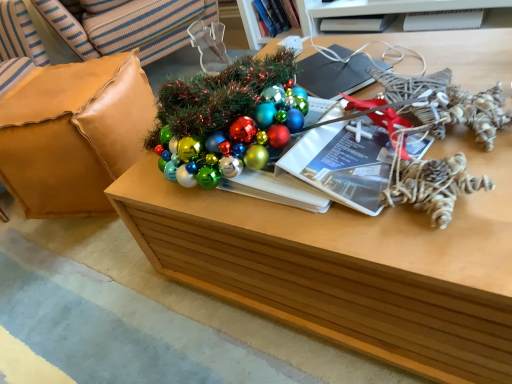
Question: Which direction should I rotate to face black matte magazine at upper center, which is the 2th magazine in front-to-back order, — up or down?

Choices:
 (A) down
 (B) up

Answer: (B)

Question: Would you say wooden table at center is part of white plastic magazine at upper right, which is counted as the third magazine, starting from the front,'s contents?

Choices:
 (A) no
 (B) yes

Answer: (A)

Question: Can you confirm if white plastic magazine at upper right, the first magazine viewed from the top, is positioned to the right of wooden table at center?

Choices:
 (A) no
 (B) yes

Answer: (B)

Question: Is white plastic magazine at upper right, which is counted as the third magazine, starting from the front, not inside wooden table at center?

Choices:
 (A) yes
 (B) no

Answer: (A)

Question: From the image's perspective, is white plastic magazine at upper right, acting as the 3th magazine starting from the left, located beneath wooden table at center?

Choices:
 (A) yes
 (B) no

Answer: (B)

Question: Is the depth of white plastic magazine at upper right, the 1th magazine from the right, less than that of wooden table at center?

Choices:
 (A) yes
 (B) no

Answer: (B)

Question: Can you see white plastic magazine at upper right, the 1th magazine from the right, touching wooden table at center?

Choices:
 (A) yes
 (B) no

Answer: (B)

Question: Can you confirm if leather cushion at left is shorter than matte paper magazine at center, which ranks as the third magazine in back-to-front order?

Choices:
 (A) no
 (B) yes

Answer: (A)

Question: Does leather cushion at left appear on the left side of matte paper magazine at center, which ranks as the third magazine in back-to-front order?

Choices:
 (A) no
 (B) yes

Answer: (B)

Question: Is leather cushion at left oriented towards matte paper magazine at center, marked as the first magazine in a bottom-to-top arrangement?

Choices:
 (A) yes
 (B) no

Answer: (A)

Question: Is leather cushion at left next to matte paper magazine at center, arranged as the 1th magazine when viewed from the left, and touching it?

Choices:
 (A) yes
 (B) no

Answer: (B)

Question: Is leather cushion at left completely or partially outside of matte paper magazine at center, which is the third magazine in top-to-bottom order?

Choices:
 (A) yes
 (B) no

Answer: (A)

Question: Is the position of leather cushion at left less distant than that of matte paper magazine at center, which ranks as the third magazine in back-to-front order?

Choices:
 (A) yes
 (B) no

Answer: (B)

Question: Is twisted rope ornament at right inside leather cushion at left?

Choices:
 (A) yes
 (B) no

Answer: (B)